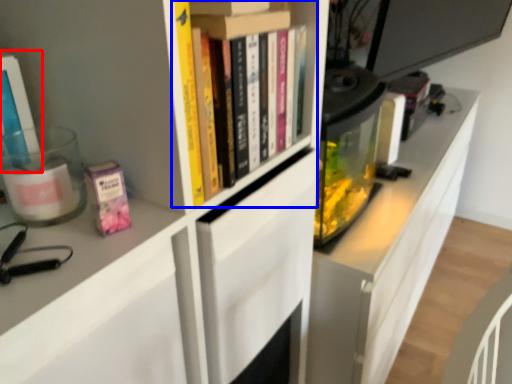
Question: Among these objects, which one is nearest to the camera, book (highlighted by a red box) or book (highlighted by a blue box)?

Choices:
 (A) book
 (B) book

Answer: (A)